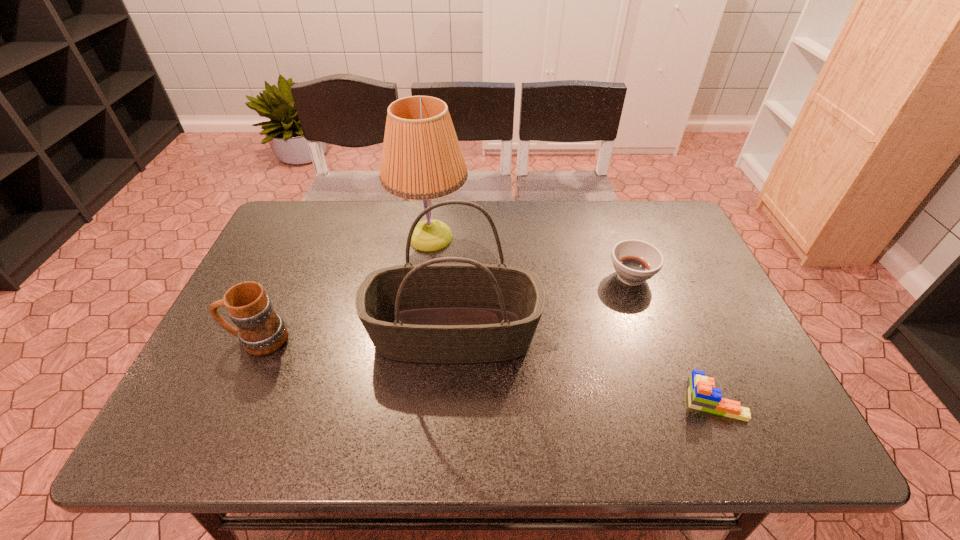
Find the location of a particular element. Image resolution: width=960 pixels, height=540 pixels. blank area in the image that satisfies the following two spatial constraints: 1. on the side of the Lego near the pull switch; 2. on the right side of the lamp is located at coordinates [x=409, y=400].

At what (x,y) coordinates should I click in order to perform the action: click on free location that satisfies the following two spatial constraints: 1. on the side of the basket near the pull switch; 2. on the right side of the lamp. Please return your answer as a coordinate pair (x, y). Looking at the image, I should click on (418, 334).

Where is `vacant region that satisfies the following two spatial constraints: 1. on the side of the second tallest object near the pull switch; 2. on the left side of the tallest object`? Image resolution: width=960 pixels, height=540 pixels. vacant region that satisfies the following two spatial constraints: 1. on the side of the second tallest object near the pull switch; 2. on the left side of the tallest object is located at coordinates (418, 334).

Find the location of a particular element. free space that satisfies the following two spatial constraints: 1. on the side of the Lego with the handle; 2. on the left side of the third shortest object is located at coordinates (230, 400).

Find the location of a particular element. free space that satisfies the following two spatial constraints: 1. on the side of the lamp near the pull switch; 2. on the left side of the fourth shortest object is located at coordinates (418, 334).